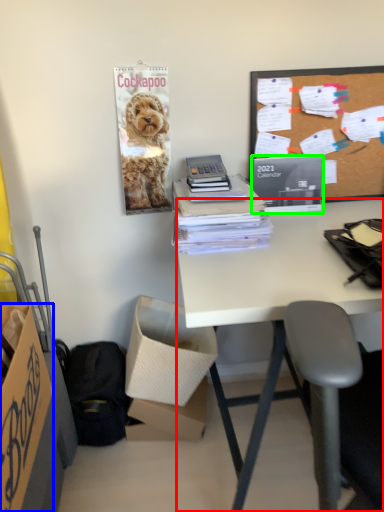
Question: Which object is positioned farthest from desk (highlighted by a red box)? Select from box (highlighted by a blue box) and magazine (highlighted by a green box).

Choices:
 (A) box
 (B) magazine

Answer: (A)